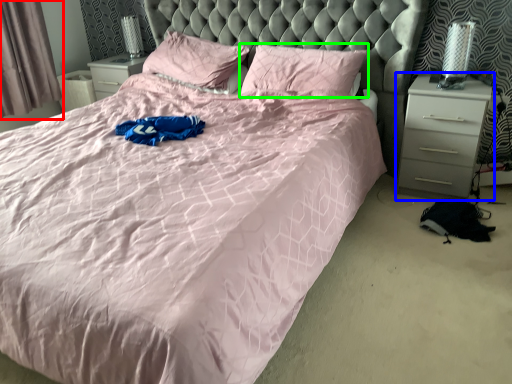
Question: Based on their relative distances, which object is farther from curtain (highlighted by a red box)? Choose from nightstand (highlighted by a blue box) and pillow (highlighted by a green box).

Choices:
 (A) nightstand
 (B) pillow

Answer: (A)